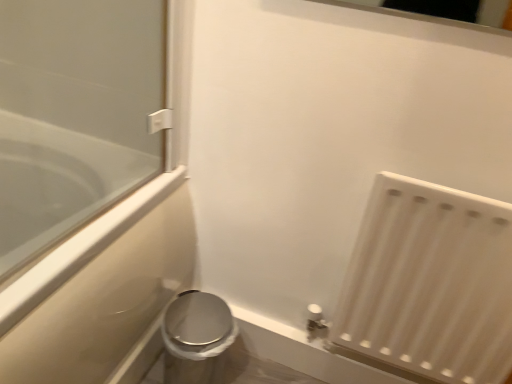
Question: Does white matte radiator at lower right have a lesser height compared to clear glass bathtub at left?

Choices:
 (A) no
 (B) yes

Answer: (B)

Question: Is white matte radiator at lower right located outside clear glass bathtub at left?

Choices:
 (A) no
 (B) yes

Answer: (B)

Question: Considering the relative positions of white matte radiator at lower right and clear glass bathtub at left in the image provided, is white matte radiator at lower right to the left of clear glass bathtub at left from the viewer's perspective?

Choices:
 (A) yes
 (B) no

Answer: (B)

Question: Considering the relative positions of white matte radiator at lower right and clear glass bathtub at left in the image provided, is white matte radiator at lower right to the right of clear glass bathtub at left from the viewer's perspective?

Choices:
 (A) yes
 (B) no

Answer: (A)

Question: Could you tell me if white matte radiator at lower right is turned towards clear glass bathtub at left?

Choices:
 (A) no
 (B) yes

Answer: (A)

Question: Does white matte radiator at lower right have a greater width compared to clear glass bathtub at left?

Choices:
 (A) yes
 (B) no

Answer: (B)

Question: Is satin silver toilet at lower left at the left side of clear glass bathtub at left?

Choices:
 (A) no
 (B) yes

Answer: (A)

Question: Can you confirm if satin silver toilet at lower left is thinner than clear glass bathtub at left?

Choices:
 (A) yes
 (B) no

Answer: (A)

Question: From a real-world perspective, does satin silver toilet at lower left sit lower than clear glass bathtub at left?

Choices:
 (A) no
 (B) yes

Answer: (B)

Question: Considering the relative sizes of satin silver toilet at lower left and clear glass bathtub at left in the image provided, is satin silver toilet at lower left smaller than clear glass bathtub at left?

Choices:
 (A) no
 (B) yes

Answer: (B)

Question: Does satin silver toilet at lower left come in front of clear glass bathtub at left?

Choices:
 (A) no
 (B) yes

Answer: (A)

Question: Can you confirm if satin silver toilet at lower left is positioned to the right of clear glass bathtub at left?

Choices:
 (A) no
 (B) yes

Answer: (B)

Question: Are clear glass bathtub at left and satin silver toilet at lower left located far from each other?

Choices:
 (A) no
 (B) yes

Answer: (A)